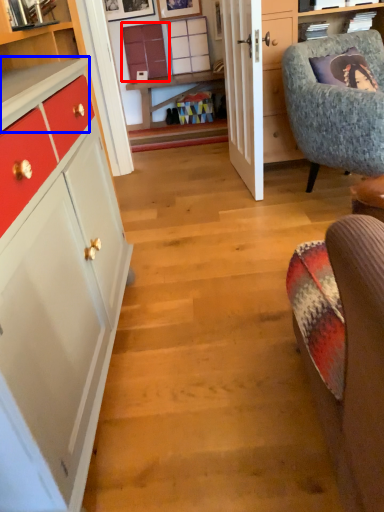
Question: Which object appears closest to the camera in this image, cabinetry (highlighted by a red box) or counter top (highlighted by a blue box)?

Choices:
 (A) cabinetry
 (B) counter top

Answer: (B)